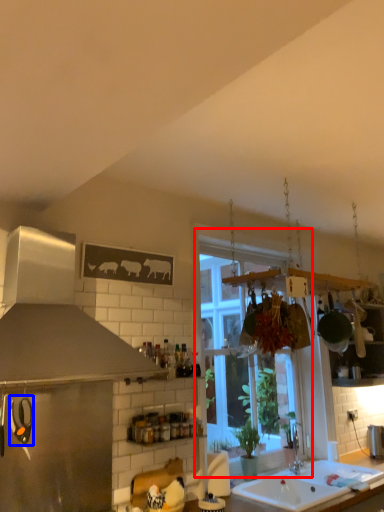
Question: Which object appears farthest to the camera in this image, window (highlighted by a red box) or appliance (highlighted by a blue box)?

Choices:
 (A) window
 (B) appliance

Answer: (A)